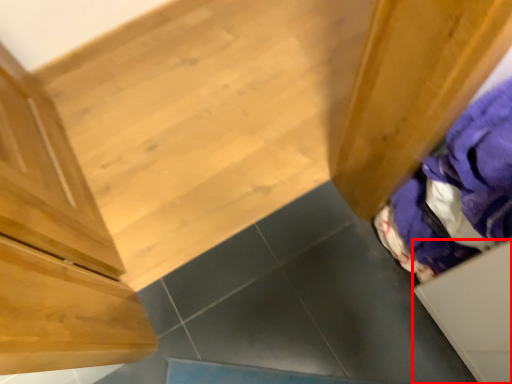
Question: In this image, where is drawer (annotated by the red box) located relative to clothing?

Choices:
 (A) right
 (B) left

Answer: (A)